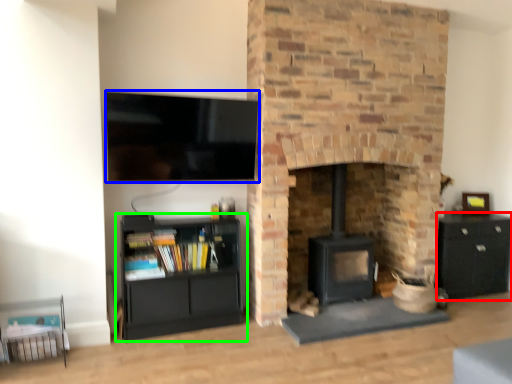
Question: Which object is the closest to the cabinetry (highlighted by a red box)? Choose among these: television (highlighted by a blue box) or shelf (highlighted by a green box).

Choices:
 (A) television
 (B) shelf

Answer: (B)